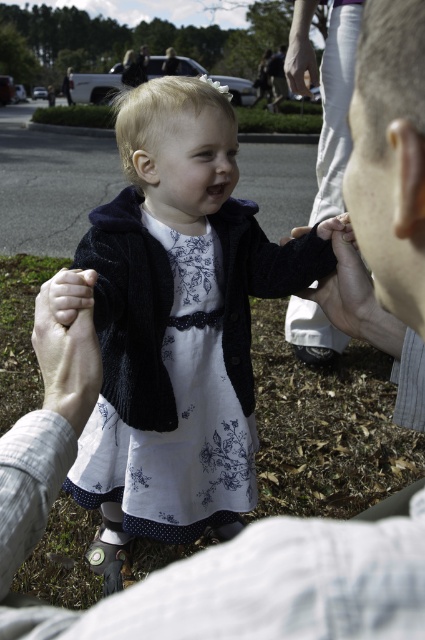
How much distance is there between floral dress at center and smooth skin hand at center?

A distance of 4.82 feet exists between floral dress at center and smooth skin hand at center.

Is point (193, 499) positioned before point (312, 305)?

Yes.

This screenshot has width=425, height=640. Describe the element at coordinates (178, 324) in the screenshot. I see `floral dress at center` at that location.

Where is `floral dress at center`? The height and width of the screenshot is (640, 425). floral dress at center is located at coordinates (178, 324).

Can you confirm if smooth skin hand at center is positioned to the left of black fuzzy hand at center?

No, smooth skin hand at center is not to the left of black fuzzy hand at center.

Does smooth skin hand at center lie behind black fuzzy hand at center?

No, smooth skin hand at center is closer to the viewer.

Who is more forward, (326, 131) or (323, 317)?

Point (323, 317) is in front.

Find the location of `smooth skin hand at center`. smooth skin hand at center is located at coordinates (336, 106).

Can you confirm if floral dress at center is bigger than white smooth skin at center?

Yes, floral dress at center is bigger than white smooth skin at center.

Which of these two, floral dress at center or white smooth skin at center, stands taller?

With more height is floral dress at center.

Is point (224, 221) positioned behind point (82, 333)?

Yes, point (224, 221) is behind point (82, 333).

Where is `floral dress at center`? Image resolution: width=425 pixels, height=640 pixels. floral dress at center is located at coordinates [x=178, y=324].